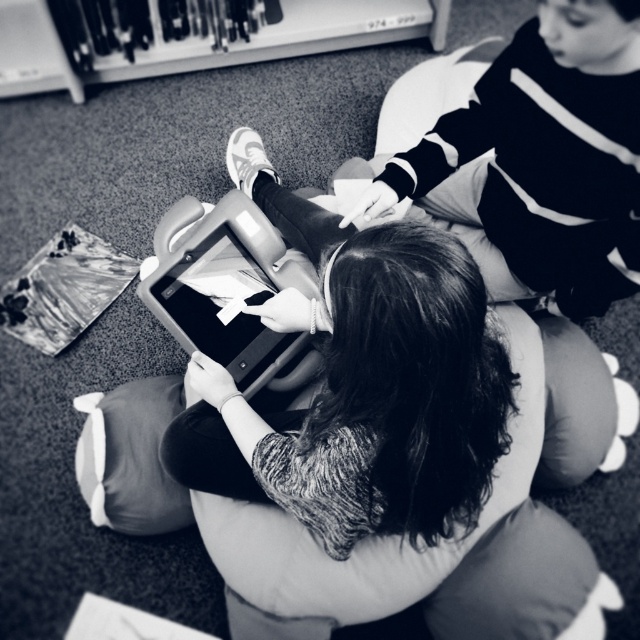
Question: Is smooth black sweater at upper right below matte plastic tablet at center?

Choices:
 (A) yes
 (B) no

Answer: (B)

Question: Which of the following is the closest to the observer?

Choices:
 (A) (200, 336)
 (B) (605, 154)

Answer: (B)

Question: Can you confirm if smooth black sweater at upper right is smaller than matte plastic tablet at center?

Choices:
 (A) no
 (B) yes

Answer: (A)

Question: Does smooth black sweater at upper right have a greater width compared to matte plastic tablet at center?

Choices:
 (A) yes
 (B) no

Answer: (A)